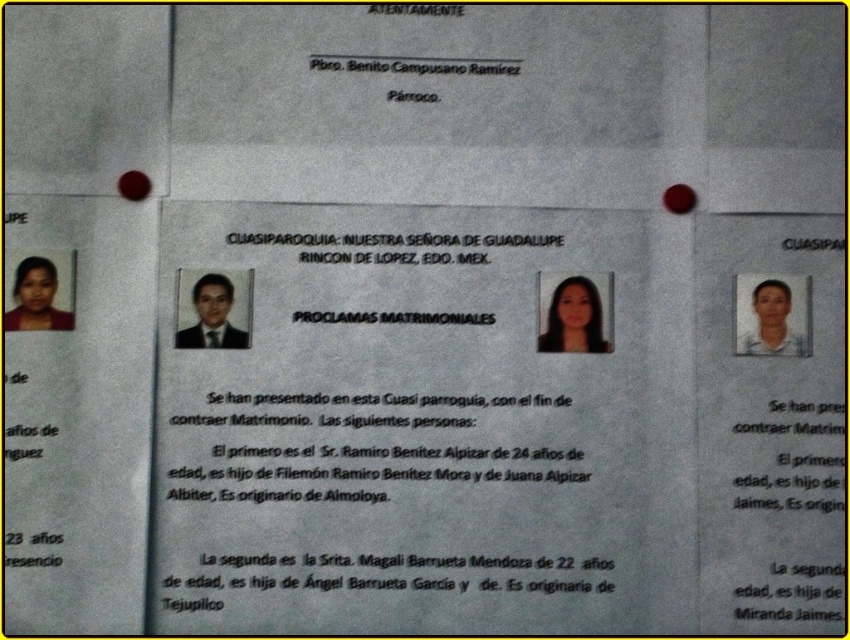
You are a Spanish teacher preparing a lesson on matrimonial announcements. You notice the black paper text at center and the smooth black hair at center in the document. How far apart are these two elements?

The black paper text at center and the smooth black hair at center are 10.22 centimeters apart.

Based on the scene described, which object is taller between the smooth black hair at center and the matte black portrait at left?

The matte black portrait at left is taller than the smooth black hair at center.

You are an observer looking at the document pinned to the wall with two red thumbtacks. You notice the black paper text at center and the smooth black hair at center. Which of these two elements is taller?

The black paper text at center is taller than the smooth black hair at center.